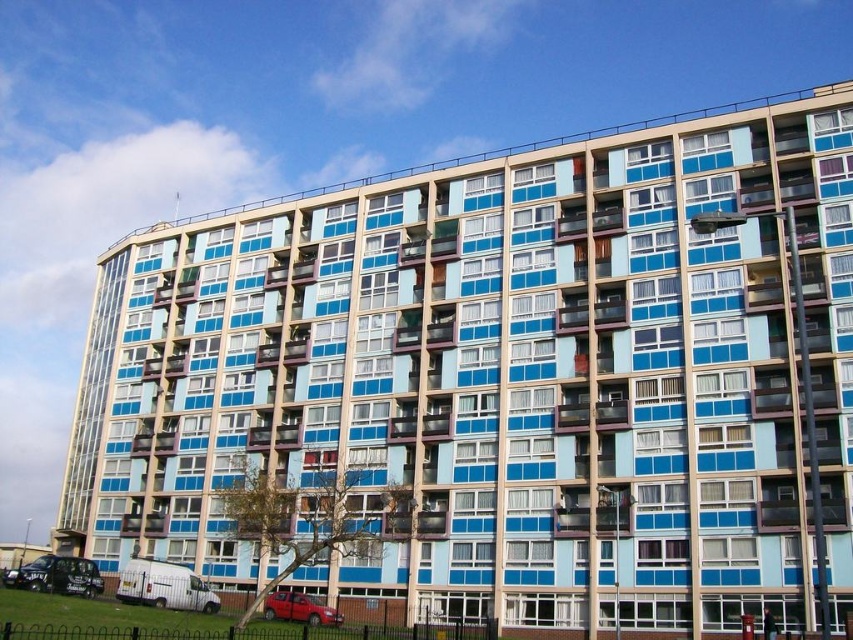
Based on the photo, is black matte taxi at lower left wider than metallic red car at lower center?

Yes, black matte taxi at lower left is wider than metallic red car at lower center.

Which is behind, point (91, 588) or point (316, 620)?

The point (91, 588) is more distant.

Does point (39, 563) come farther from viewer compared to point (321, 608)?

That is True.

Identify the location of black matte taxi at lower left. This screenshot has height=640, width=853. (57, 576).